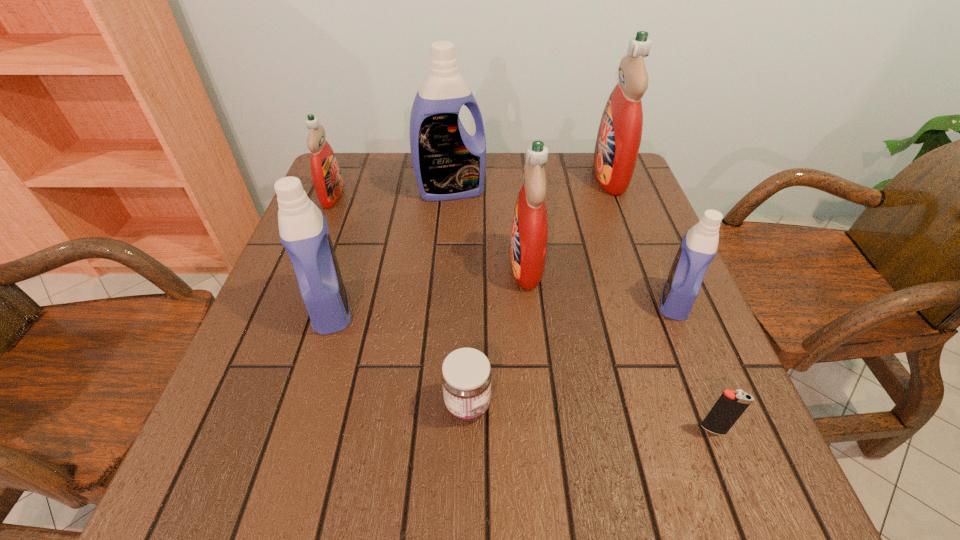
Where is `free location that satisfies the following two spatial constraints: 1. on the front surface of the second red detergent from right to left; 2. on the back side of the igniter`? Image resolution: width=960 pixels, height=540 pixels. free location that satisfies the following two spatial constraints: 1. on the front surface of the second red detergent from right to left; 2. on the back side of the igniter is located at coordinates (543, 429).

This screenshot has width=960, height=540. Find the location of `free space that satisfies the following two spatial constraints: 1. on the front surface of the smallest blue detergent; 2. on the right side of the rightmost red detergent`. free space that satisfies the following two spatial constraints: 1. on the front surface of the smallest blue detergent; 2. on the right side of the rightmost red detergent is located at coordinates (657, 301).

The height and width of the screenshot is (540, 960). What are the coordinates of `free point that satisfies the following two spatial constraints: 1. on the front surface of the black igniter; 2. on the right side of the rightmost red detergent` in the screenshot? It's located at (706, 429).

At what (x,y) coordinates should I click in order to perform the action: click on vacant space that satisfies the following two spatial constraints: 1. on the front surface of the leftmost object; 2. on the left side of the second smallest blue detergent. Please return your answer as a coordinate pair (x, y). Image resolution: width=960 pixels, height=540 pixels. Looking at the image, I should click on (287, 307).

Find the location of a particular element. This screenshot has height=540, width=960. vacant space that satisfies the following two spatial constraints: 1. on the front surface of the nearest red detergent; 2. on the left side of the smallest blue detergent is located at coordinates (530, 301).

At what (x,y) coordinates should I click in order to perform the action: click on free space that satisfies the following two spatial constraints: 1. on the back side of the black igniter; 2. on the front label of the jam. Please return your answer as a coordinate pair (x, y). The width and height of the screenshot is (960, 540). Looking at the image, I should click on (704, 404).

The image size is (960, 540). I want to click on vacant space that satisfies the following two spatial constraints: 1. on the front surface of the smallest blue detergent; 2. on the left side of the smallest red detergent, so [x=289, y=301].

Locate an element on the screen. This screenshot has width=960, height=540. vacant space that satisfies the following two spatial constraints: 1. on the front surface of the biggest red detergent; 2. on the right side of the igniter is located at coordinates (706, 429).

What are the coordinates of `vacant space that satisfies the following two spatial constraints: 1. on the front side of the igniter; 2. on the left side of the biggest blue detergent` in the screenshot? It's located at (431, 429).